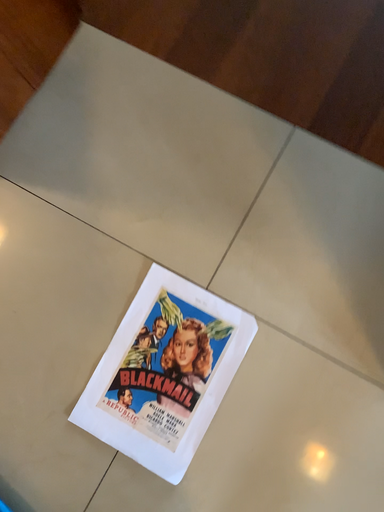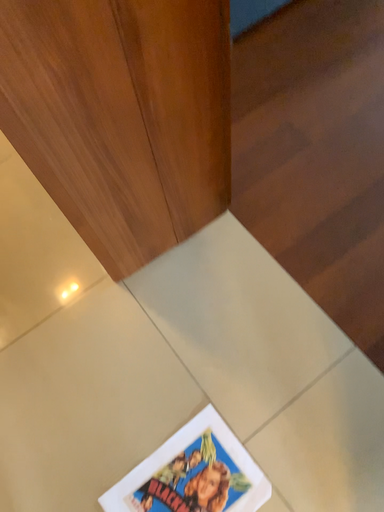
Question: How did the camera likely rotate when shooting the video?

Choices:
 (A) rotated right
 (B) rotated left

Answer: (B)